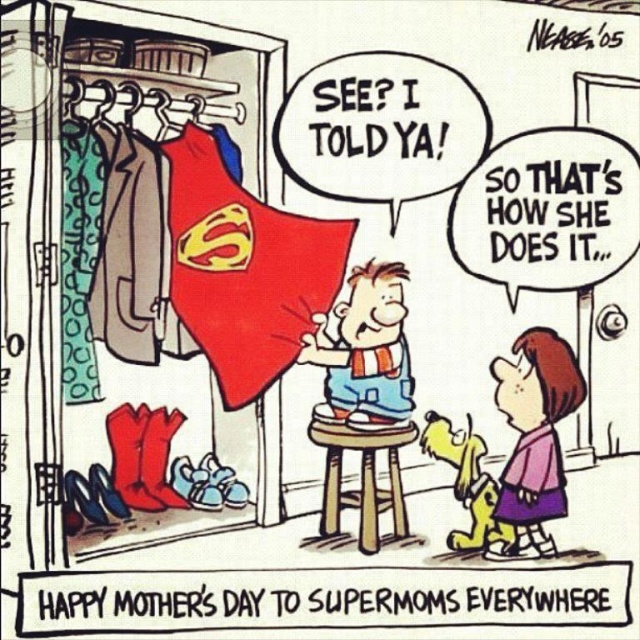
Can you confirm if purple fabric dress at lower center is bigger than wooden stool at center?

Indeed, purple fabric dress at lower center has a larger size compared to wooden stool at center.

This screenshot has width=640, height=640. In order to click on purple fabric dress at lower center in this screenshot , I will do `click(532, 438)`.

Who is more forward, (x=518, y=556) or (x=378, y=412)?

Positioned in front is point (x=518, y=556).

Is purple fabric dress at lower center to the right of smooth blue shorts at center from the viewer's perspective?

Correct, you'll find purple fabric dress at lower center to the right of smooth blue shorts at center.

Between point (529, 502) and point (365, 310), which one is positioned in front?

Point (529, 502) is more forward.

The height and width of the screenshot is (640, 640). I want to click on purple fabric dress at lower center, so click(532, 438).

In the scene shown: Can you confirm if smooth blue shorts at center is smaller than wooden stool at center?

Yes, smooth blue shorts at center is smaller than wooden stool at center.

Who is more distant from viewer, (396, 387) or (314, 422)?

Point (396, 387)

Is point (342, 416) less distant than point (403, 429)?

Yes, it is.

Locate an element on the screen. Image resolution: width=640 pixels, height=640 pixels. smooth blue shorts at center is located at coordinates (364, 349).